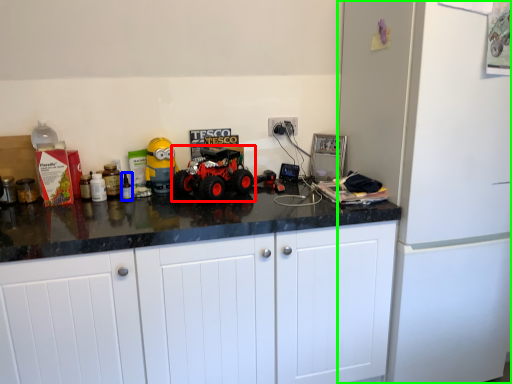
Question: Based on their relative distances, which object is nearer to land vehicle (highlighted by a red box)? Choose from bottle (highlighted by a blue box) and refrigerator (highlighted by a green box).

Choices:
 (A) bottle
 (B) refrigerator

Answer: (A)